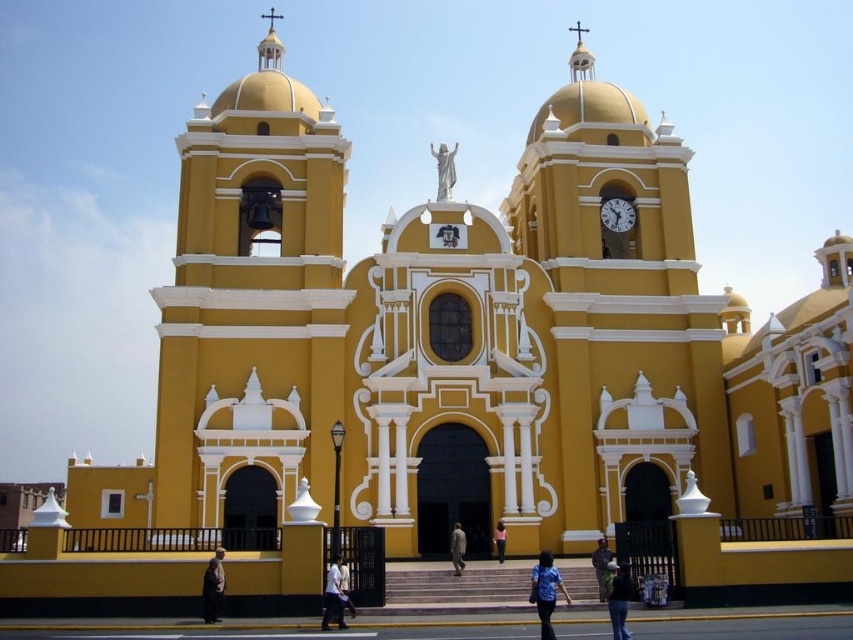
Consider the image. You are standing in front of the church and notice a dark brown leather jacket at lower left and a white marble statue at center. Which object is positioned lower in the image?

The dark brown leather jacket at lower left is positioned below the white marble statue at center, so it is lower in the image.